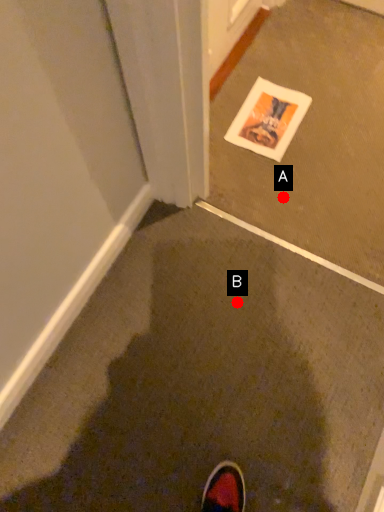
Question: Two points are circled on the image, labeled by A and B beside each circle. Among these points, which one is nearest to the camera?

Choices:
 (A) A is closer
 (B) B is closer

Answer: (B)